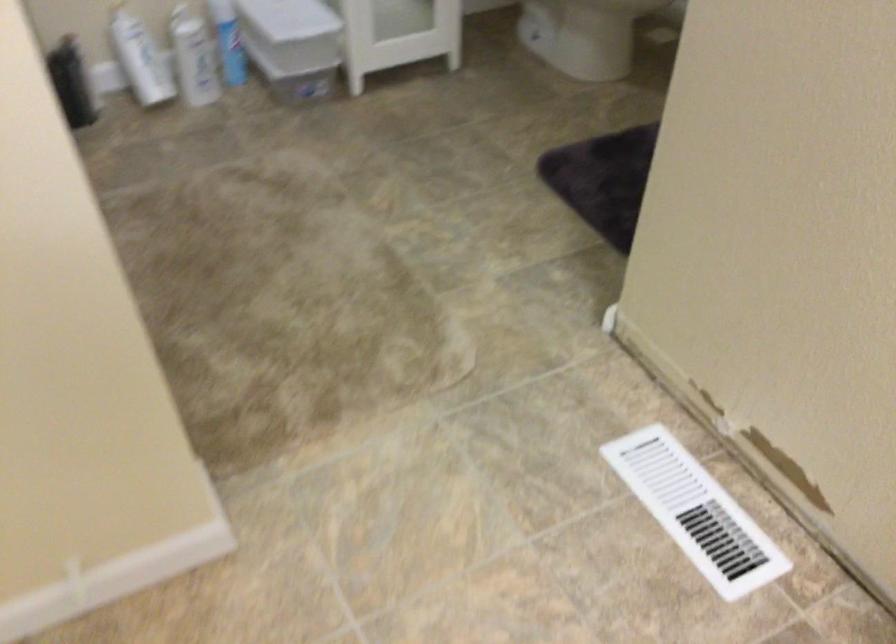
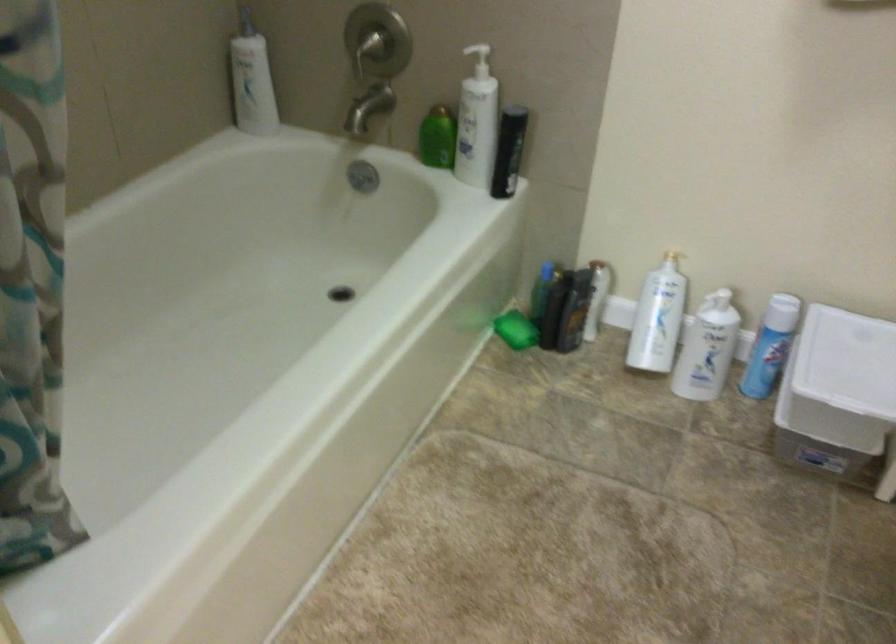
Question: Based on the continuous images, in which direction is the camera rotating? Reply with the corresponding letter.

Choices:
 (A) Left
 (B) Right
 (C) Up
 (D) Down

Answer: (A)